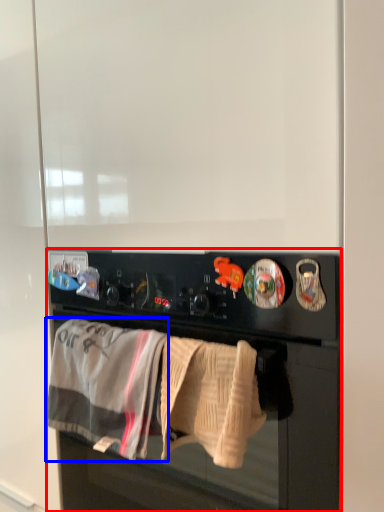
Question: Which object is further to the camera taking this photo, home appliance (highlighted by a red box) or bath towel (highlighted by a blue box)?

Choices:
 (A) home appliance
 (B) bath towel

Answer: (B)